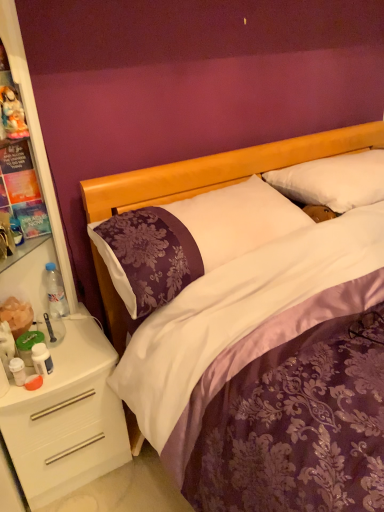
Find the location of `vacant location below white plastic dresser at left (from a real-world perspective)`. vacant location below white plastic dresser at left (from a real-world perspective) is located at coordinates (68, 340).